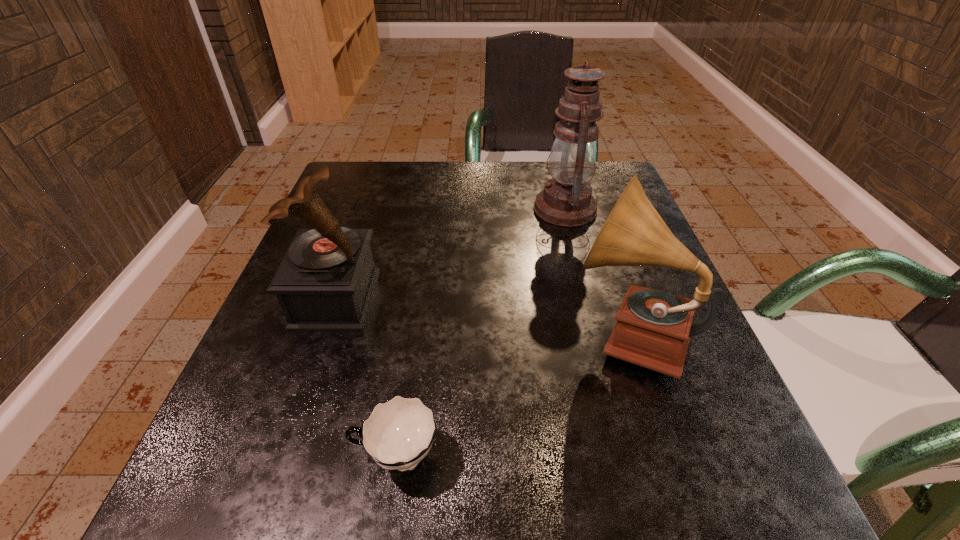
Identify the location of vacant space at the far edge. This screenshot has width=960, height=540. (533, 207).

In the image, there is a desktop. Where is `free space at the near edge`? The height and width of the screenshot is (540, 960). free space at the near edge is located at coordinates (372, 495).

In the image, there is a desktop. Where is `free space at the left edge`? This screenshot has width=960, height=540. free space at the left edge is located at coordinates (322, 406).

You are a GUI agent. You are given a task and a screenshot of the screen. Output one action in this format:
    pyautogui.click(x=<x>, y=<y>)
    Task: Click on the vacant space at the right edge of the desktop
    The height and width of the screenshot is (540, 960).
    Given the screenshot: What is the action you would take?
    pyautogui.click(x=605, y=294)

The image size is (960, 540). In the image, there is a desktop. Identify the location of vacant area at the far left corner. (350, 206).

In the image, there is a desktop. Identify the location of vacant area at the near left corner. (265, 535).

Identify the location of vacant area at the far right corner of the desktop. (616, 199).

In order to click on free space at the near right corner of the desktop in this screenshot , I will do `click(674, 522)`.

Image resolution: width=960 pixels, height=540 pixels. In order to click on empty location between the third object from right to left and the oil lamp in this screenshot , I will do `click(481, 333)`.

Where is `empty location between the farthest object and the left phonograph_record`? The height and width of the screenshot is (540, 960). empty location between the farthest object and the left phonograph_record is located at coordinates (450, 254).